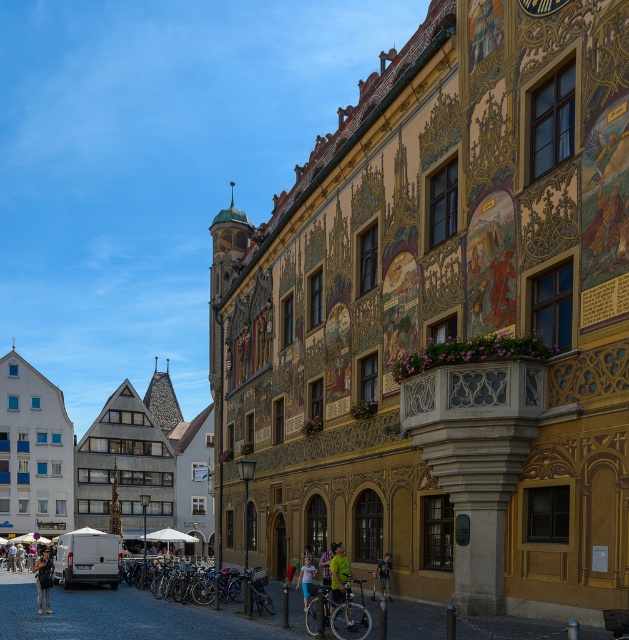
Can you confirm if white textured building at center is wider than green fabric jacket at center?

Indeed, white textured building at center has a greater width compared to green fabric jacket at center.

Is point (192, 452) positioned before point (386, 557)?

That is False.

Between point (79, 490) and point (386, 595), which one is positioned behind?

The point (79, 490) is behind.

The image size is (629, 640). In order to click on white textured building at center in this screenshot , I will do `click(104, 458)`.

Which is more to the right, green jersey at center or green fabric jacket at center?

green fabric jacket at center is more to the right.

Between green jersey at center and green fabric jacket at center, which one has less height?

With less height is green fabric jacket at center.

Does point (347, 563) come closer to viewer compared to point (384, 570)?

Yes, it is in front of point (384, 570).

Find the location of a particular element. green jersey at center is located at coordinates (338, 577).

From the picture: Can you confirm if green jersey at center is shorter than light blue denim shorts at lower center?

Indeed, green jersey at center has a lesser height compared to light blue denim shorts at lower center.

Does green jersey at center appear over light blue denim shorts at lower center?

Indeed, green jersey at center is positioned over light blue denim shorts at lower center.

Locate an element on the screen. This screenshot has height=640, width=629. green jersey at center is located at coordinates (338, 577).